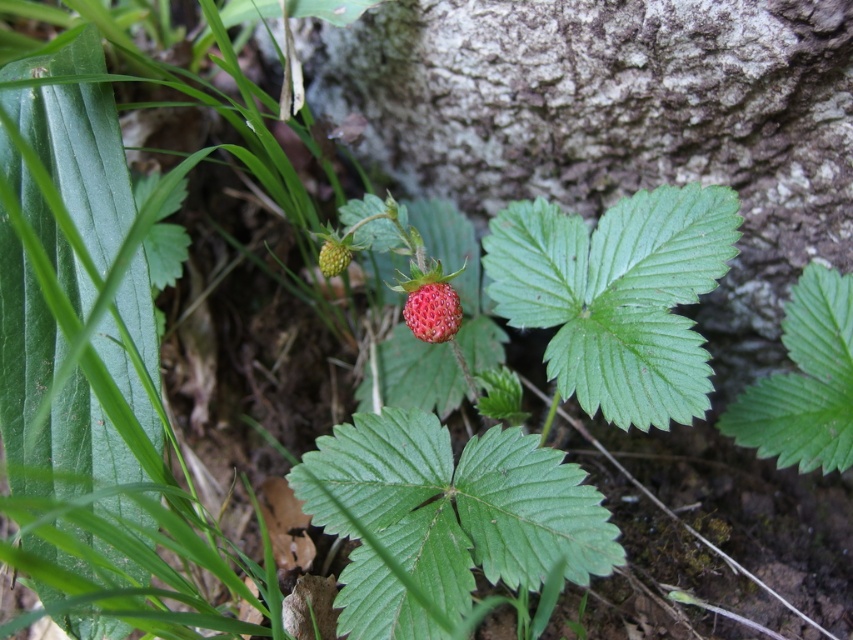
Question: Is glossy red strawberry at center above green matte strawberry at center?

Choices:
 (A) no
 (B) yes

Answer: (A)

Question: Which of the following is the farthest from the observer?

Choices:
 (A) (426, 310)
 (B) (321, 266)

Answer: (B)

Question: From the image, what is the correct spatial relationship of glossy red strawberry at center in relation to green matte strawberry at center?

Choices:
 (A) left
 (B) right

Answer: (B)

Question: Is the position of glossy red strawberry at center more distant than that of green matte strawberry at center?

Choices:
 (A) yes
 (B) no

Answer: (B)